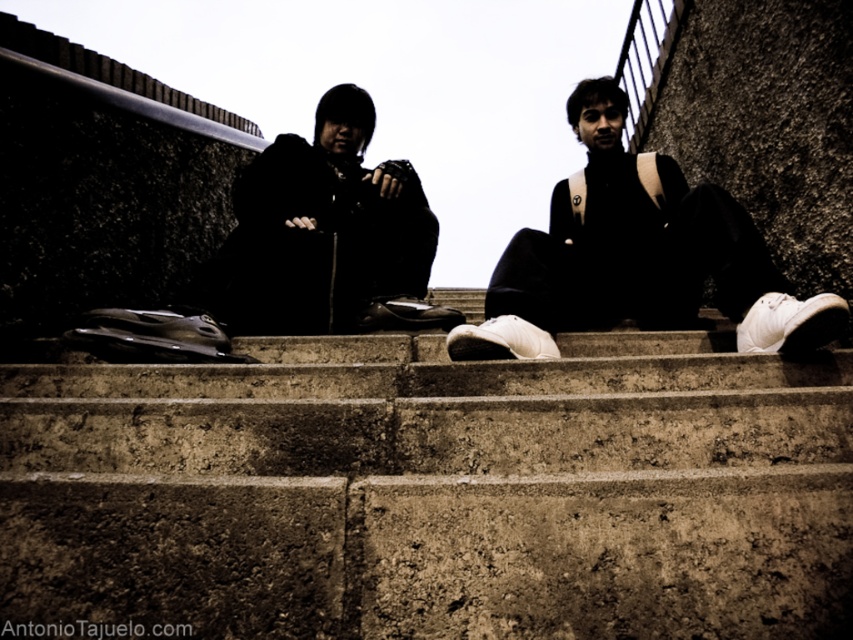
Looking at this image, you are planning to place a small potted plant between the concrete stairs at center and the white matte sneakers at center. Based on their sizes, do you think there will be enough space for the plant?

The concrete stairs at center might be wider than white matte sneakers at center, so there might be sufficient space to place a small potted plant between them.

You are standing in the scene and want to place a small object exactly at point [637,256]. What object will this point land on?

The point [637,256] is on white matte sneakers at center, so placing the object there would land it on the white matte sneakers at center.

You are a photographer needing to set up a tripod between the concrete stairs at center and the black matte jacket at center. The tripod requires a minimum of 1 meter of space. Can you fit it there?

The distance between the concrete stairs at center and the black matte jacket at center is 1.58 meters, which is more than the required 1 meter. Therefore, the tripod can be placed there with sufficient space.